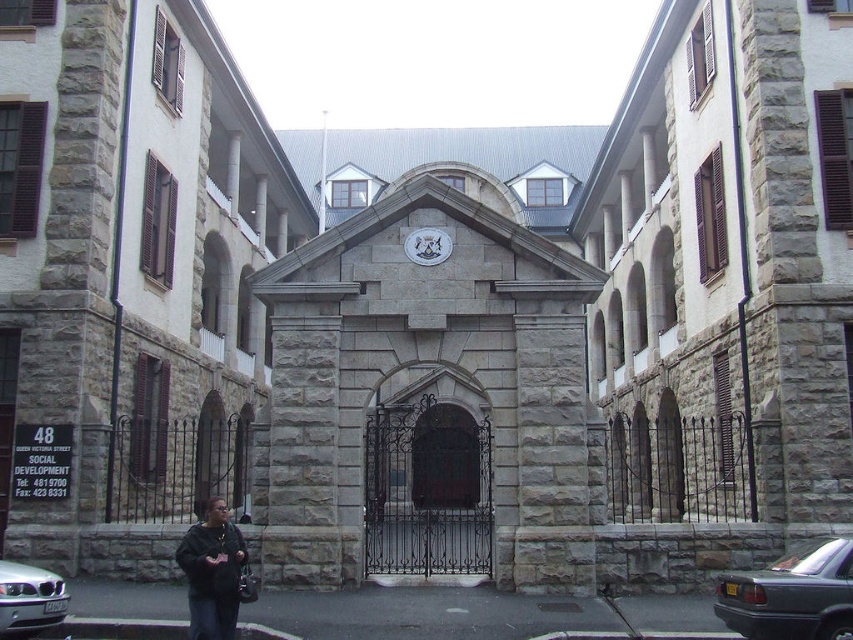
Question: Which point is farther from the camera taking this photo?

Choices:
 (A) (219, 612)
 (B) (311, 420)

Answer: (B)

Question: Which of the following is the closest to the observer?

Choices:
 (A) (48, 620)
 (B) (851, 588)
 (C) (410, 237)
 (D) (219, 538)

Answer: (B)

Question: Which point is closer to the camera taking this photo?

Choices:
 (A) (189, 564)
 (B) (448, 236)

Answer: (A)

Question: Where is gray stone gate at center located in relation to white glossy clock at center in the image?

Choices:
 (A) above
 (B) below

Answer: (A)

Question: Is the position of gray stone gate at center less distant than that of silver metallic car at lower left?

Choices:
 (A) yes
 (B) no

Answer: (B)

Question: Can you confirm if dark gray metallic car at lower right is positioned below white glossy clock at center?

Choices:
 (A) yes
 (B) no

Answer: (A)